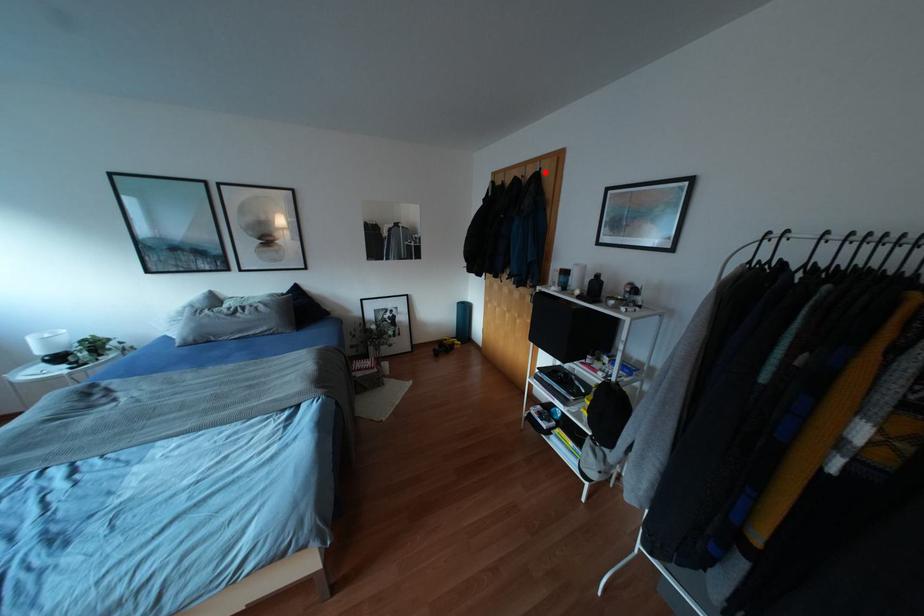
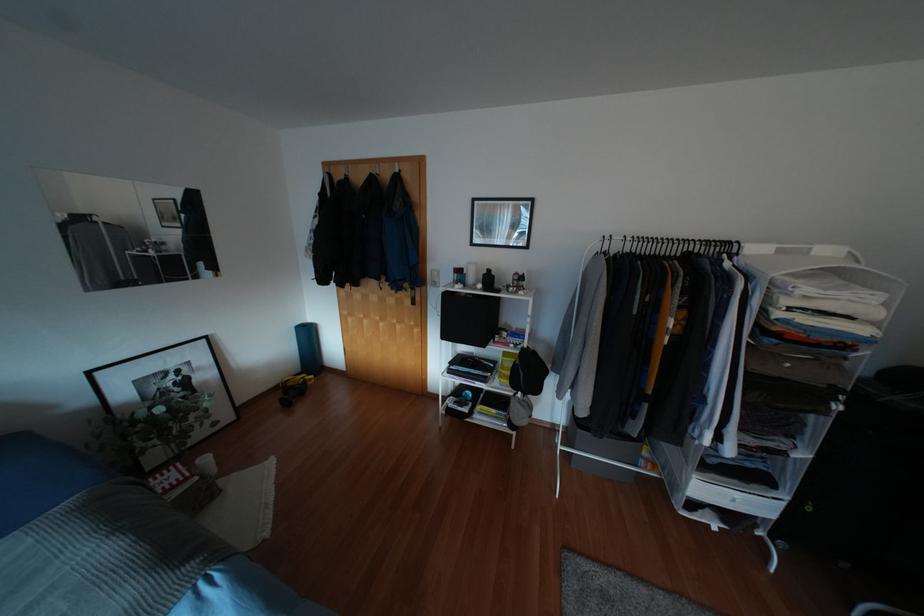
In the second image, find the point that corresponds to the highlighted location in the first image.

(406, 176)